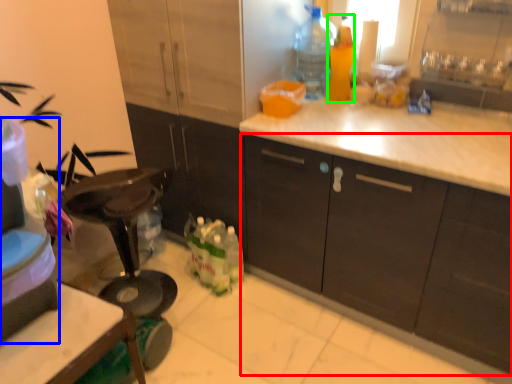
Question: Estimate the real-world distances between objects in this image. Which object is farther from cabinetry (highlighted by a red box), appliance (highlighted by a blue box) or bottle (highlighted by a green box)?

Choices:
 (A) appliance
 (B) bottle

Answer: (A)